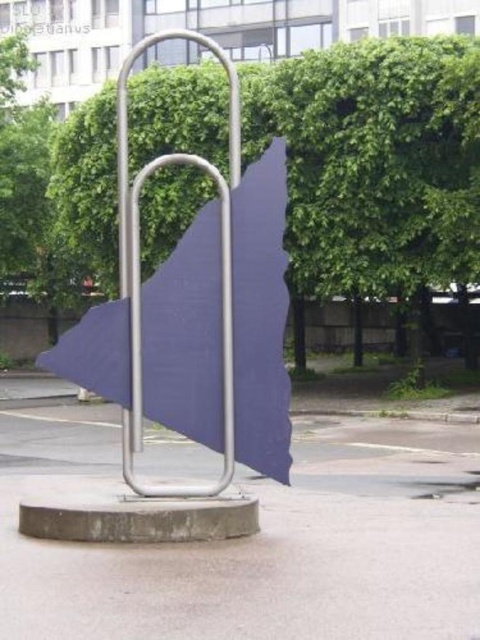
Question: Is green leafy tree at center thinner than satin silver paperclip at center?

Choices:
 (A) yes
 (B) no

Answer: (B)

Question: Does satin silver paperclip at center have a smaller size compared to satin silver pole at center?

Choices:
 (A) no
 (B) yes

Answer: (B)

Question: Which of the following is the closest to the observer?

Choices:
 (A) (154, 276)
 (B) (226, 268)

Answer: (B)

Question: Which point is farther to the camera?

Choices:
 (A) satin silver pole at center
 (B) green leafy tree at center

Answer: (B)

Question: Which point is farther to the camera?

Choices:
 (A) satin silver paperclip at center
 (B) satin silver pole at center

Answer: (A)

Question: Does satin silver paperclip at center appear on the left side of satin silver pole at center?

Choices:
 (A) yes
 (B) no

Answer: (A)